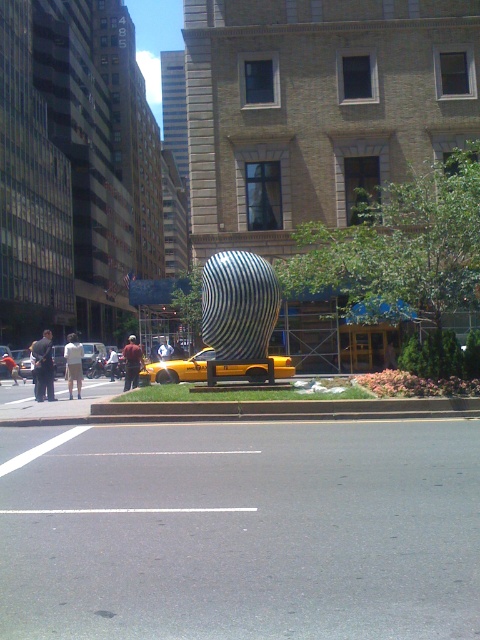
You are a photographer standing on the sidewalk. You want to take a photo of the dark gray pants at lower left and the white cotton shirt at center. However, the yellow taxi parked behind the sculpture is blocking your view. Can you still capture both subjects in the same frame without moving the taxi?

The white cotton shirt at center is behind the dark gray pants at lower left, so if the yellow taxi is blocking the view, you might not be able to capture both subjects in the same frame without moving the taxi.

You are a pedestrian standing at the dark gray pants at lower left position. You want to cross the road to reach the sculpture. Which direction should you walk to avoid the yellow matte taxi at center?

The yellow matte taxi at center is to the right of dark gray pants at lower left. To avoid the taxi, you should walk to the left side of the dark gray pants at lower left position towards the sculpture.

You are a pedestrian standing on the sidewalk and want to cross the street to reach the sculpture. You see the yellow matte taxi at center and the dark gray pants at lower left. Which object is closer to you?

The yellow matte taxi at center is closer to you than the dark gray pants at lower left.